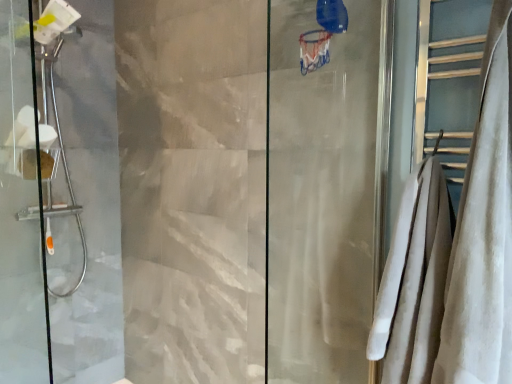
Describe the element at coordinates (59, 198) in the screenshot. The width and height of the screenshot is (512, 384). I see `brushed metal showerhead at left, the 1th screen door when ordered from back to front` at that location.

Describe the element at coordinates (20, 208) in the screenshot. I see `transparent glass shower door at left, positioned as the 2th screen door in back-to-front order` at that location.

Identify the location of white velvety towel at right. The image size is (512, 384). tap(483, 232).

From a real-world perspective, is transparent glass shower door at left, positioned as the 2th screen door in back-to-front order, on top of white soft towel at right?

Yes, from a real-world perspective, transparent glass shower door at left, positioned as the 2th screen door in back-to-front order, is over white soft towel at right

Is transparent glass shower door at left, marked as the 1th screen door in a front-to-back arrangement, smaller than white soft towel at right?

Correct, transparent glass shower door at left, marked as the 1th screen door in a front-to-back arrangement, occupies less space than white soft towel at right.

Considering the relative sizes of transparent glass shower door at left, marked as the 1th screen door in a front-to-back arrangement, and white soft towel at right in the image provided, is transparent glass shower door at left, marked as the 1th screen door in a front-to-back arrangement, thinner than white soft towel at right?

Indeed, transparent glass shower door at left, marked as the 1th screen door in a front-to-back arrangement, has a lesser width compared to white soft towel at right.

Are transparent glass shower door at left, positioned as the 2th screen door in back-to-front order, and white soft towel at right making contact?

No, transparent glass shower door at left, positioned as the 2th screen door in back-to-front order, is not making contact with white soft towel at right.

Does brushed metal showerhead at left, the 1th screen door when ordered from back to front, come in front of transparent glass shower door at left, marked as the 1th screen door in a front-to-back arrangement?

No, it is behind transparent glass shower door at left, marked as the 1th screen door in a front-to-back arrangement.

Can we say brushed metal showerhead at left, the 1th screen door when ordered from back to front, lies outside transparent glass shower door at left, positioned as the 2th screen door in back-to-front order?

Yes, brushed metal showerhead at left, the 1th screen door when ordered from back to front, is outside of transparent glass shower door at left, positioned as the 2th screen door in back-to-front order.

Based on the photo, is brushed metal showerhead at left, the second screen door positioned from the front, not near transparent glass shower door at left, marked as the 1th screen door in a front-to-back arrangement?

That's not correct — brushed metal showerhead at left, the second screen door positioned from the front, is a little close to transparent glass shower door at left, marked as the 1th screen door in a front-to-back arrangement.

Is brushed metal showerhead at left, the 1th screen door when ordered from back to front, taller than transparent glass shower door at left, marked as the 1th screen door in a front-to-back arrangement?

Yes.

There is a white soft towel at right. Where is `shower curtain above it (from a real-world perspective)`? The image size is (512, 384). shower curtain above it (from a real-world perspective) is located at coordinates (483, 232).

Considering the sizes of white velvety towel at right and white soft towel at right in the image, is white velvety towel at right taller or shorter than white soft towel at right?

Clearly, white velvety towel at right is taller compared to white soft towel at right.

How much distance is there between white soft towel at right and transparent glass shower door at left, positioned as the 2th screen door in back-to-front order?

1.73 meters.

Which screen door is the 1st one when counting from the left side of the white soft towel at right? Please provide its 2D coordinates.

[(20, 208)]

Who is smaller, white soft towel at right or transparent glass shower door at left, positioned as the 2th screen door in back-to-front order?

transparent glass shower door at left, positioned as the 2th screen door in back-to-front order.

From the image's perspective, is white soft towel at right over transparent glass shower door at left, marked as the 1th screen door in a front-to-back arrangement?

Incorrect, from the image's perspective, white soft towel at right is lower than transparent glass shower door at left, marked as the 1th screen door in a front-to-back arrangement.

Who is more distant, transparent glass shower door at left, marked as the 1th screen door in a front-to-back arrangement, or white velvety towel at right?

transparent glass shower door at left, marked as the 1th screen door in a front-to-back arrangement, is further away from the camera.

Considering the points (4, 291) and (465, 198), which point is in front, point (4, 291) or point (465, 198)?

The point (465, 198) is more forward.

Does transparent glass shower door at left, marked as the 1th screen door in a front-to-back arrangement, have a lesser height compared to white velvety towel at right?

In fact, transparent glass shower door at left, marked as the 1th screen door in a front-to-back arrangement, may be taller than white velvety towel at right.

Could you measure the distance between transparent glass shower door at left, positioned as the 2th screen door in back-to-front order, and white velvety towel at right?

6.19 feet.

Between point (418, 312) and point (103, 226), which one is positioned behind?

Positioned behind is point (103, 226).

Is white soft towel at right not close to brushed metal showerhead at left, the 1th screen door when ordered from back to front?

Yes.

From the image's perspective, is white soft towel at right beneath brushed metal showerhead at left, the 1th screen door when ordered from back to front?

Yes, from the image's perspective, white soft towel at right is beneath brushed metal showerhead at left, the 1th screen door when ordered from back to front.

In terms of height, does white velvety towel at right look taller or shorter compared to transparent glass shower door at left, marked as the 1th screen door in a front-to-back arrangement?

Considering their sizes, white velvety towel at right has less height than transparent glass shower door at left, marked as the 1th screen door in a front-to-back arrangement.

Does white velvety towel at right come in front of transparent glass shower door at left, positioned as the 2th screen door in back-to-front order?

That is True.

From a real-world perspective, is white velvety towel at right under transparent glass shower door at left, marked as the 1th screen door in a front-to-back arrangement?

Actually, white velvety towel at right is physically above transparent glass shower door at left, marked as the 1th screen door in a front-to-back arrangement, in the real world.

Where is `screen door that is the 1st one when counting backward from the white soft towel at right`? The width and height of the screenshot is (512, 384). screen door that is the 1st one when counting backward from the white soft towel at right is located at coordinates (20, 208).

Image resolution: width=512 pixels, height=384 pixels. There is a transparent glass shower door at left, marked as the 1th screen door in a front-to-back arrangement. In order to click on screen door above it (from a real-world perspective) in this screenshot , I will do `click(59, 198)`.

When comparing their distances from transparent glass shower door at left, marked as the 1th screen door in a front-to-back arrangement, does white velvety towel at right or brushed metal showerhead at left, the second screen door positioned from the front, seem further?

The object further to transparent glass shower door at left, marked as the 1th screen door in a front-to-back arrangement, is white velvety towel at right.

Looking at this image, which object lies further to the anchor point white velvety towel at right, white soft towel at right or transparent glass shower door at left, marked as the 1th screen door in a front-to-back arrangement?

Among the two, transparent glass shower door at left, marked as the 1th screen door in a front-to-back arrangement, is located further to white velvety towel at right.

From the picture: When comparing their distances from transparent glass shower door at left, marked as the 1th screen door in a front-to-back arrangement, does white soft towel at right or brushed metal showerhead at left, the 1th screen door when ordered from back to front, seem further?

white soft towel at right is positioned further to the anchor transparent glass shower door at left, marked as the 1th screen door in a front-to-back arrangement.

Based on their spatial positions, is white soft towel at right or white velvety towel at right closer to brushed metal showerhead at left, the second screen door positioned from the front?

white soft towel at right is positioned closer to the anchor brushed metal showerhead at left, the second screen door positioned from the front.

Based on their spatial positions, is white soft towel at right or white velvety towel at right closer to transparent glass shower door at left, positioned as the 2th screen door in back-to-front order?

Among the two, white soft towel at right is located nearer to transparent glass shower door at left, positioned as the 2th screen door in back-to-front order.

When comparing their distances from transparent glass shower door at left, marked as the 1th screen door in a front-to-back arrangement, does brushed metal showerhead at left, the 1th screen door when ordered from back to front, or white velvety towel at right seem further?

Among the two, white velvety towel at right is located further to transparent glass shower door at left, marked as the 1th screen door in a front-to-back arrangement.

When comparing their distances from white velvety towel at right, does brushed metal showerhead at left, the 1th screen door when ordered from back to front, or white soft towel at right seem further?

Among the two, brushed metal showerhead at left, the 1th screen door when ordered from back to front, is located further to white velvety towel at right.

Considering their positions, is white velvety towel at right positioned closer to brushed metal showerhead at left, the 1th screen door when ordered from back to front, than transparent glass shower door at left, positioned as the 2th screen door in back-to-front order?

Among the two, transparent glass shower door at left, positioned as the 2th screen door in back-to-front order, is located nearer to brushed metal showerhead at left, the 1th screen door when ordered from back to front.

Locate an element on the screen. Image resolution: width=512 pixels, height=384 pixels. bath towel between transparent glass shower door at left, marked as the 1th screen door in a front-to-back arrangement, and white velvety towel at right from left to right is located at coordinates (414, 280).

Locate an element on the screen. bath towel located between brushed metal showerhead at left, the second screen door positioned from the front, and white velvety towel at right in the left-right direction is located at coordinates (414, 280).

Image resolution: width=512 pixels, height=384 pixels. I want to click on screen door located between brushed metal showerhead at left, the second screen door positioned from the front, and white velvety towel at right in the left-right direction, so click(x=20, y=208).

Find the location of a particular element. This screenshot has height=384, width=512. screen door between brushed metal showerhead at left, the second screen door positioned from the front, and white soft towel at right, in the horizontal direction is located at coordinates (20, 208).